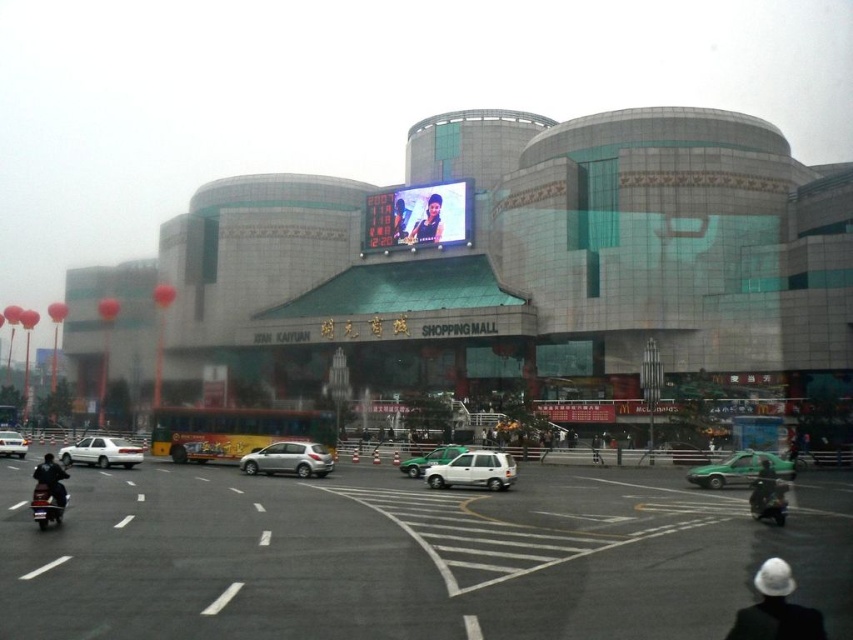
You are a delivery person who needs to pick up a package from the parking lot. You see a white matte sedan at center and a dark green helmet at lower right. Which object is closer to you?

The dark green helmet at lower right is behind the white matte sedan at center, so the white matte sedan at center is closer to you.

You are a photographer standing in front of the Kaiyuan Shopping Mall. You want to take a photo that includes both the glassy gray building at center and the dark green helmet at lower right. Which object will appear wider in the photo?

The glassy gray building at center will appear wider in the photo because its width surpasses that of the dark green helmet at lower right according to the description.

You are a delivery person who needs to park your 1.8 meters tall delivery cart in the parking area of Kaiyuan Shopping Mall. You see a white matte sedan at center and a dark green helmet at lower right. Can you safely place your cart between them without hitting the ceiling?

The white matte sedan at center has a greater height compared to dark green helmet at lower right. Since the sedan is taller, the available space between them would depend on the sedan height. If the sedan is taller than 1.8 meters, the cart can fit. However, the description only states the sedan is taller than the helmet, not specifying exact heights. Without knowing the sedan height, it is uncertain if the cart will fit.